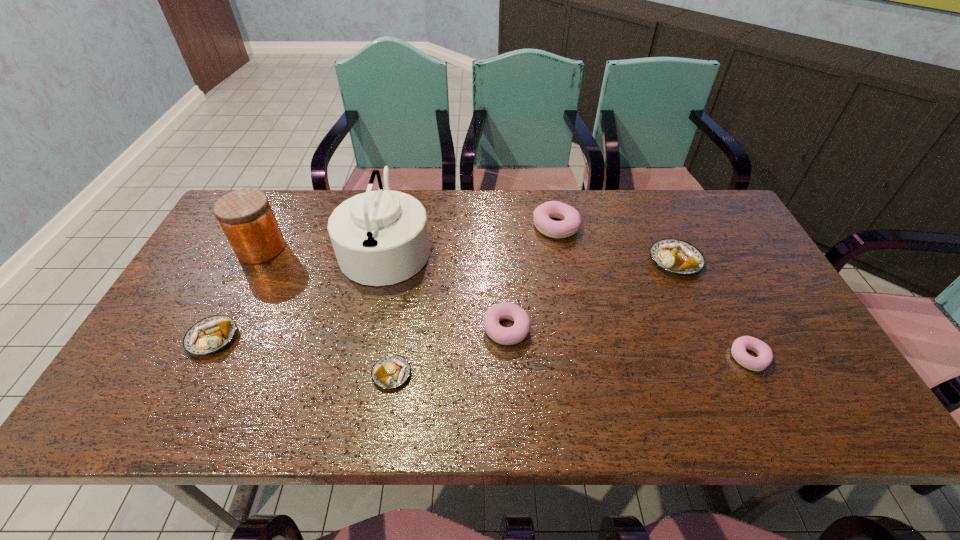
The height and width of the screenshot is (540, 960). In order to click on free point between the orange jar and the second smallest brown pastry in this screenshot , I will do `click(237, 293)`.

Locate an element on the screen. free space between the second brown pastry from left to right and the rightmost pink pastry is located at coordinates (570, 366).

Image resolution: width=960 pixels, height=540 pixels. I want to click on vacant point located between the smallest pink pastry and the second brown pastry from left to right, so click(570, 366).

This screenshot has height=540, width=960. Find the location of `free spot between the fifth nearest pastry and the smallest pink pastry`. free spot between the fifth nearest pastry and the smallest pink pastry is located at coordinates (712, 309).

In order to click on free spot between the fourth pastry from right to left and the second brown pastry from left to right in this screenshot , I will do `click(449, 352)`.

The width and height of the screenshot is (960, 540). Find the location of `object identified as the seventh closest to the second tallest object`. object identified as the seventh closest to the second tallest object is located at coordinates (765, 355).

The width and height of the screenshot is (960, 540). I want to click on the third closest object to the second brown pastry from left to right, so click(209, 335).

What are the coordinates of `pastry that is the third closest to the tallest object` in the screenshot? It's located at (392, 371).

Locate which pastry is the fifth closest to the fifth nearest pastry. Please provide its 2D coordinates. Your answer should be formatted as a tuple, i.e. [(x, y)], where the tuple contains the x and y coordinates of a point satisfying the conditions above.

[(209, 335)]

Find the location of a particular element. pink pastry that stands as the closest to the smallest pink pastry is located at coordinates (571, 220).